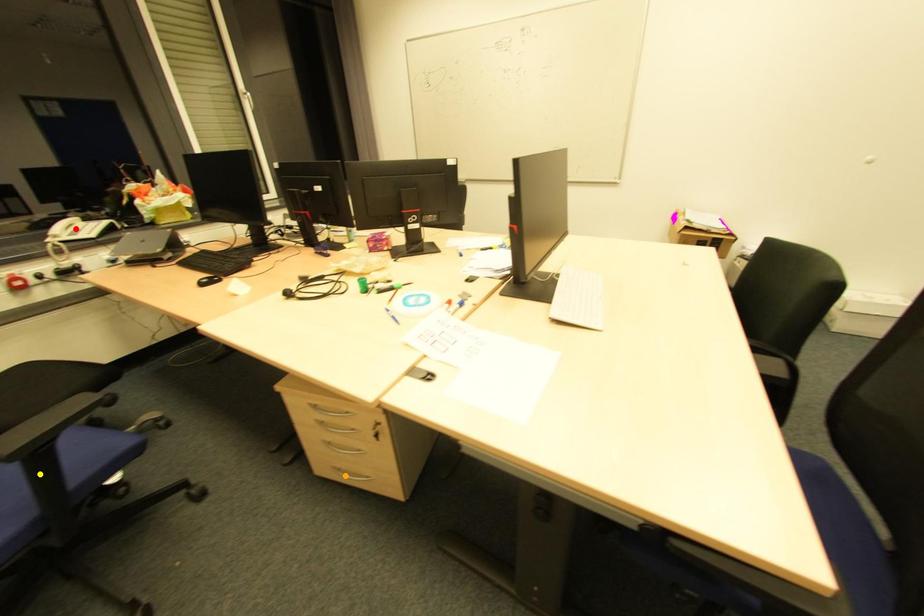
Order these from nearest to farthest:
A) yellow point
B) red point
C) orange point

red point → orange point → yellow point